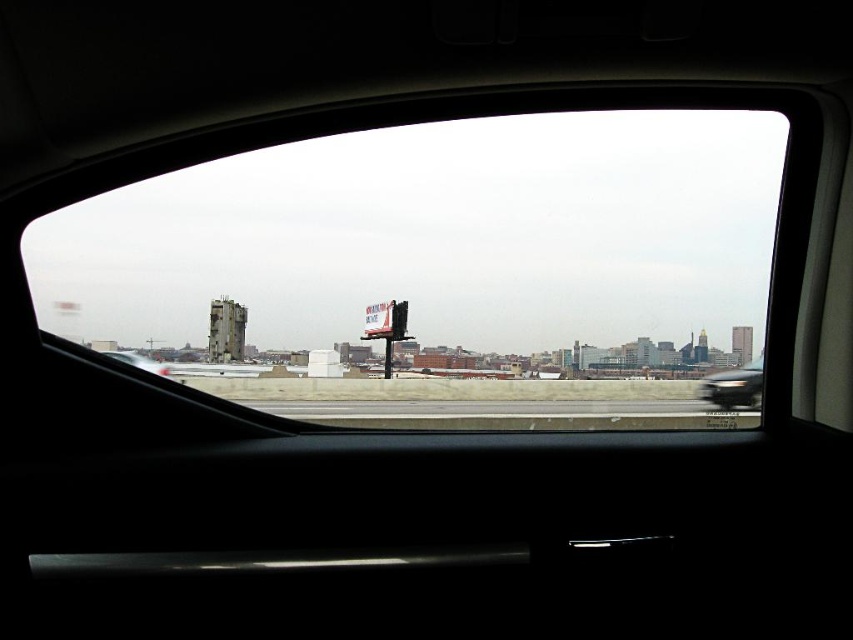
Does point (751, 410) come closer to viewer compared to point (744, 392)?

Yes, it is in front of point (744, 392).

Measure the distance between gray concrete runway at center and camera.

gray concrete runway at center is 21.53 meters away from camera.

Between point (303, 412) and point (757, 385), which one is positioned in front?

Point (303, 412) is in front.

Where is `gray concrete runway at center`? The image size is (853, 640). gray concrete runway at center is located at coordinates (495, 408).

Is transparent glass windshield at center to the left of metallic silver sedan at lower right from the viewer's perspective?

Correct, you'll find transparent glass windshield at center to the left of metallic silver sedan at lower right.

Does transparent glass windshield at center have a lesser height compared to metallic silver sedan at lower right?

In fact, transparent glass windshield at center may be taller than metallic silver sedan at lower right.

Identify the location of transparent glass windshield at center. The height and width of the screenshot is (640, 853). (434, 259).

Find the location of a particular element. Image resolution: width=853 pixels, height=640 pixels. transparent glass windshield at center is located at coordinates (434, 259).

Is transparent glass windshield at center closer to the viewer compared to gray concrete runway at center?

Yes, it is in front of gray concrete runway at center.

Between transparent glass windshield at center and gray concrete runway at center, which one has more height?

transparent glass windshield at center

Which is behind, point (477, 237) or point (515, 408)?

Point (477, 237)

This screenshot has height=640, width=853. Identify the location of transparent glass windshield at center. (434, 259).